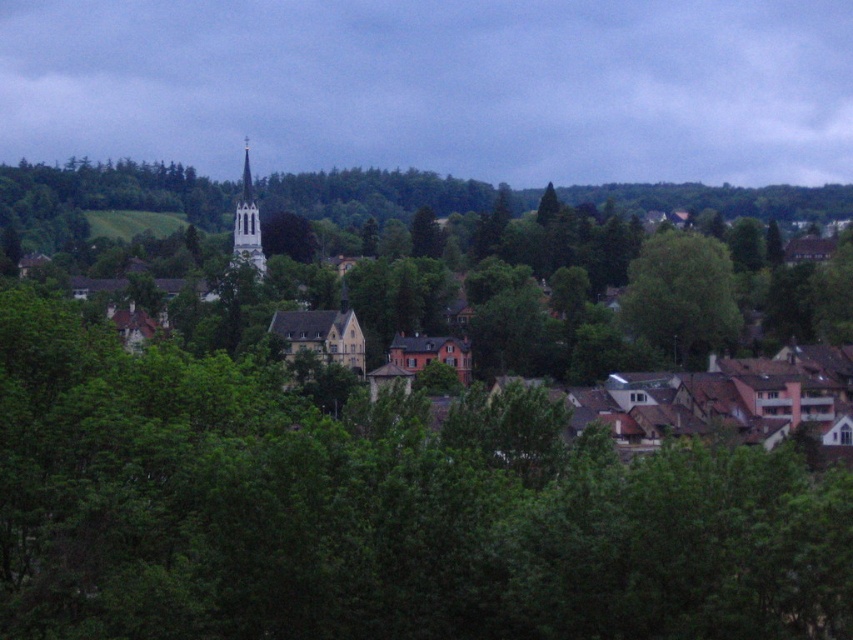
You are standing in the village and see a point marked at coordinates (680, 298). Based on the scene description, what is this point likely located on?

The point at coordinates (680, 298) is on the green leafy tree at center.

You are standing in the village and want to take a photo of both the green leafy tree at center and the smooth white steeple at center. Which object should you position to the left in your camera frame to include both in the shot?

The green leafy tree at center is positioned on the right side of smooth white steeple at center, so to include both in the shot, you should position the smooth white steeple at center to the left in your camera frame.